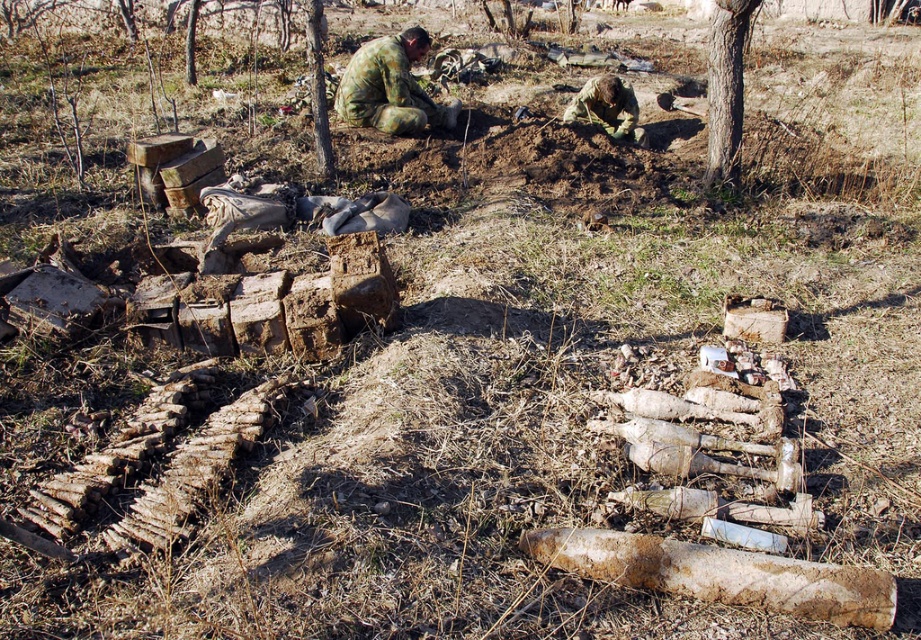
You are a photographer positioned at the edge of the forest. You want to take a photo of the camouflage fabric soldier at center and the brown bark tree at center. Which object will appear larger in your photo?

The camouflage fabric soldier at center will appear larger in the photo because it is closer to the viewer than the brown bark tree at center.

You are a hiker who has found a brown rough log at lower right and a camouflage fabric uniform at center in the forest. Which object is taller when you stand between them?

The camouflage fabric uniform at center is taller than the brown rough log at lower right.